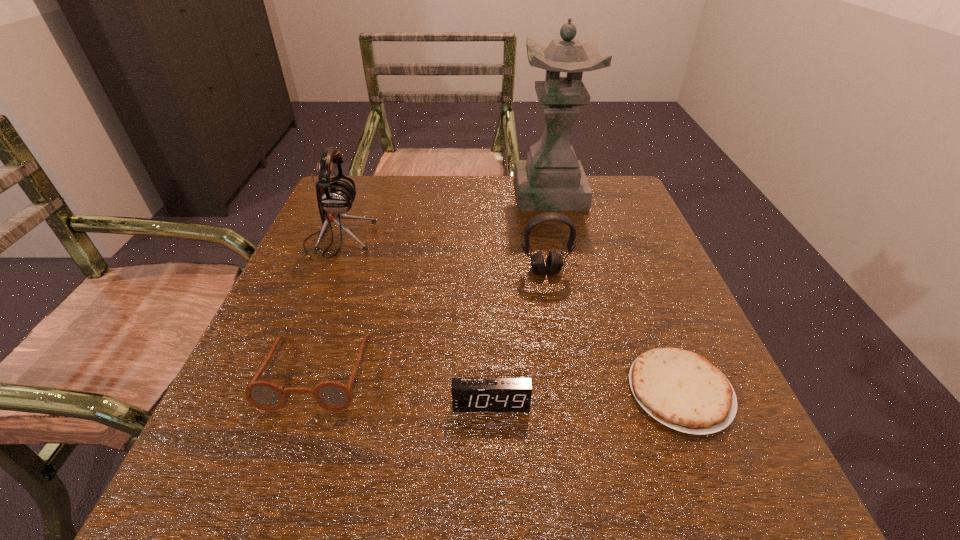
This screenshot has height=540, width=960. In order to click on spectacles present at the left edge in this screenshot , I will do `click(331, 395)`.

Where is `sculpture that is positioned at the right edge`? sculpture that is positioned at the right edge is located at coordinates (551, 179).

Find the location of `tortilla that is at the right edge`. tortilla that is at the right edge is located at coordinates (683, 390).

This screenshot has height=540, width=960. Find the location of `object that is at the far left corner`. object that is at the far left corner is located at coordinates (335, 195).

Locate an element on the screen. object that is at the far right corner is located at coordinates (551, 179).

The image size is (960, 540). In the image, there is a desktop. What are the coordinates of `free space at the far edge` in the screenshot? It's located at (451, 193).

Identify the location of free region at the near edge. (635, 494).

You are a GUI agent. You are given a task and a screenshot of the screen. Output one action in this format:
    pyautogui.click(x=<x>, y=<y>)
    Task: Click on the free region at the left edge of the desktop
    The image size is (960, 540).
    Given the screenshot: What is the action you would take?
    pyautogui.click(x=347, y=254)

Find the location of a particular element. This screenshot has height=540, width=960. vacant space at the right edge of the desktop is located at coordinates (646, 291).

Find the location of `free space at the far left corner of the desktop`. free space at the far left corner of the desktop is located at coordinates (346, 175).